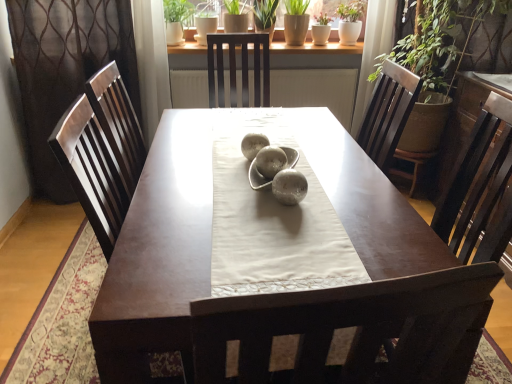
Question: From the image's perspective, would you say green matte plant at upper center, the first plant viewed from the left, is shown under green matte plant at upper center, which appears as the first plant when viewed from the right?

Choices:
 (A) no
 (B) yes

Answer: (A)

Question: Does green matte plant at upper center, which ranks as the third plant in right-to-left order, appear on the left side of green matte plant at upper center, which is the third plant in left-to-right order?

Choices:
 (A) yes
 (B) no

Answer: (A)

Question: Would you say green matte plant at upper center, the first plant viewed from the left, is a long distance from green matte plant at upper center, which is the third plant in left-to-right order?

Choices:
 (A) no
 (B) yes

Answer: (A)

Question: Considering the relative sizes of green matte plant at upper center, the first plant viewed from the left, and green matte plant at upper center, which appears as the first plant when viewed from the right, in the image provided, is green matte plant at upper center, the first plant viewed from the left, thinner than green matte plant at upper center, which appears as the first plant when viewed from the right,?

Choices:
 (A) no
 (B) yes

Answer: (A)

Question: Does green matte plant at upper center, the first plant viewed from the left, lie in front of green matte plant at upper center, which appears as the first plant when viewed from the right?

Choices:
 (A) no
 (B) yes

Answer: (B)

Question: Looking at their shapes, would you say brown textured curtain at left is wider or thinner than green matte plant at upper center, which is the third plant in left-to-right order?

Choices:
 (A) wide
 (B) thin

Answer: (A)

Question: Relative to green matte plant at upper center, which is the third plant in left-to-right order, is brown textured curtain at left in front or behind?

Choices:
 (A) front
 (B) behind

Answer: (A)

Question: From a real-world perspective, relative to green matte plant at upper center, which is the third plant in left-to-right order, is brown textured curtain at left vertically above or below?

Choices:
 (A) below
 (B) above

Answer: (A)

Question: Is brown textured curtain at left taller or shorter than green matte plant at upper center, which is the third plant in left-to-right order?

Choices:
 (A) short
 (B) tall

Answer: (B)

Question: Is brown textured curtain at left spatially inside green matte pot at upper center, marked as the 2th plant in a left-to-right arrangement, or outside of it?

Choices:
 (A) outside
 (B) inside

Answer: (A)

Question: In terms of width, does brown textured curtain at left look wider or thinner when compared to green matte pot at upper center, marked as the 2th plant in a left-to-right arrangement?

Choices:
 (A) wide
 (B) thin

Answer: (A)

Question: From a real-world perspective, is brown textured curtain at left positioned above or below green matte pot at upper center, marked as the 2th plant in a left-to-right arrangement?

Choices:
 (A) below
 (B) above

Answer: (A)

Question: From their relative heights in the image, would you say brown textured curtain at left is taller or shorter than green matte pot at upper center, marked as the 2th plant in a left-to-right arrangement?

Choices:
 (A) tall
 (B) short

Answer: (A)

Question: From their relative heights in the image, would you say green matte plant at upper center, which ranks as the third plant in right-to-left order, is taller or shorter than brown textured curtain at left?

Choices:
 (A) short
 (B) tall

Answer: (A)

Question: Is point pos(175,3) positioned closer to the camera than point pos(39,107)?

Choices:
 (A) closer
 (B) farther

Answer: (B)